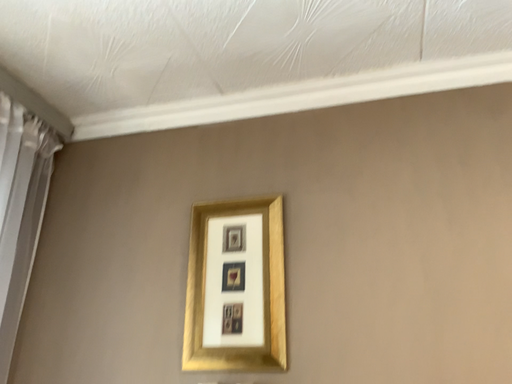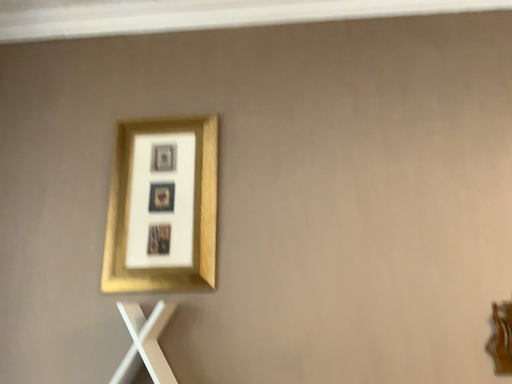
Question: Which way did the camera rotate in the video?

Choices:
 (A) rotated right
 (B) rotated left

Answer: (A)